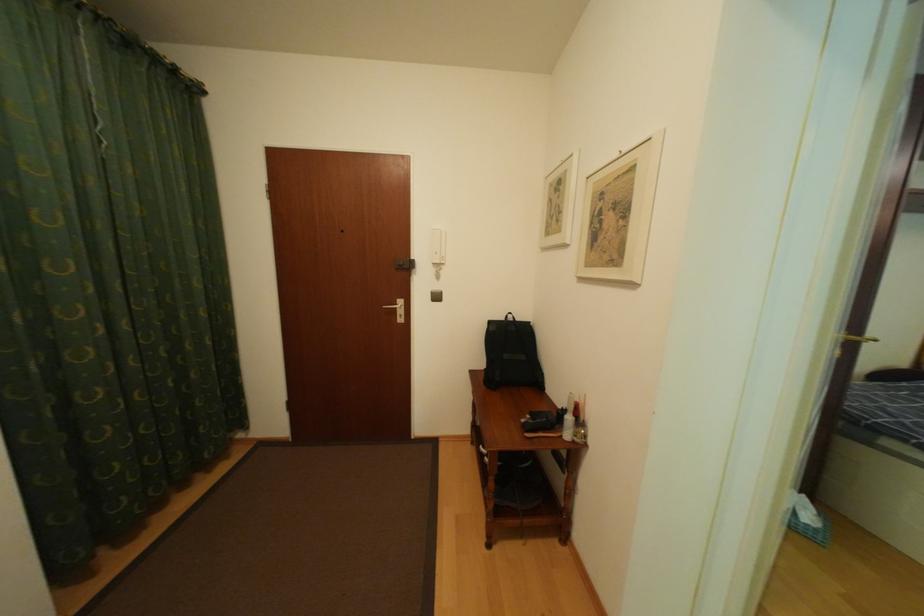
This screenshot has height=616, width=924. Describe the element at coordinates (91, 86) in the screenshot. I see `a white curtain cord` at that location.